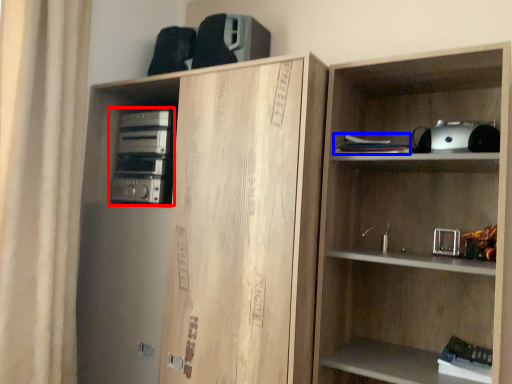
Question: Which of the following is the closest to the observer, stereo (highlighted by a red box) or book (highlighted by a blue box)?

Choices:
 (A) stereo
 (B) book

Answer: (B)